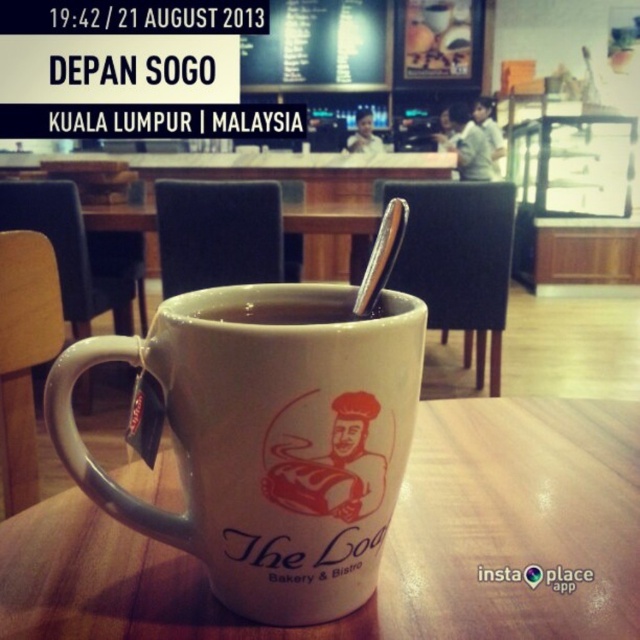
Question: Among these objects, which one is farthest from the camera?

Choices:
 (A) white matte cup at center
 (B) white wood table at center
 (C) white matte mug at center

Answer: (A)

Question: Which of these objects is positioned farthest from the white matte cup at center?

Choices:
 (A) white wood table at center
 (B) white matte mug at center

Answer: (A)

Question: Which object appears farthest from the camera in this image?

Choices:
 (A) white matte cup at center
 (B) white matte mug at center
 (C) white wood table at center

Answer: (A)

Question: Does white matte mug at center lie behind white matte cup at center?

Choices:
 (A) yes
 (B) no

Answer: (B)

Question: Does white matte mug at center have a larger size compared to white matte cup at center?

Choices:
 (A) yes
 (B) no

Answer: (A)

Question: Does white wood table at center have a greater width compared to white matte cup at center?

Choices:
 (A) no
 (B) yes

Answer: (B)